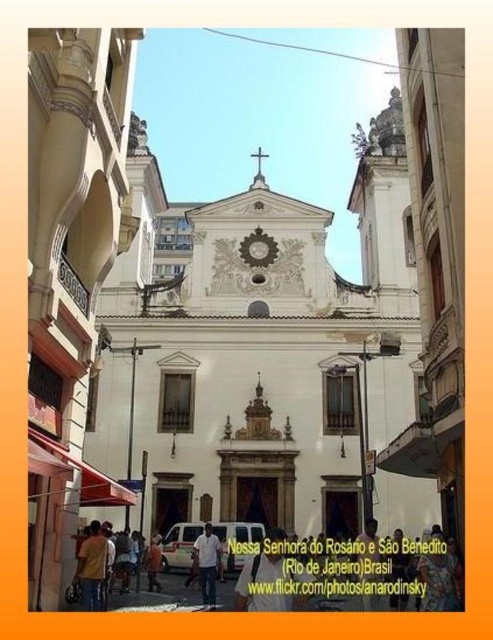
Question: Can you confirm if white marble church at center is thinner than white cotton shirt at center?

Choices:
 (A) no
 (B) yes

Answer: (A)

Question: Among these objects, which one is farthest from the camera?

Choices:
 (A) white marble church at center
 (B) dark brown leather jacket at center
 (C) yellow shirt at lower left
 (D) white stone church at center

Answer: (A)

Question: Is white marble church at center closer to the viewer compared to white matte shirt at center?

Choices:
 (A) yes
 (B) no

Answer: (B)

Question: Which object is the farthest from the yellow shirt at lower left?

Choices:
 (A) white matte shirt at center
 (B) matte gold clock at center
 (C) dark brown leather jacket at center

Answer: (B)

Question: Which object is closer to the camera taking this photo?

Choices:
 (A) white cotton shirt at center
 (B) white matte shirt at center
 (C) white marble church at center
 (D) matte gold clock at center

Answer: (A)

Question: Can you confirm if white matte shirt at center is positioned below matte gold clock at center?

Choices:
 (A) yes
 (B) no

Answer: (A)